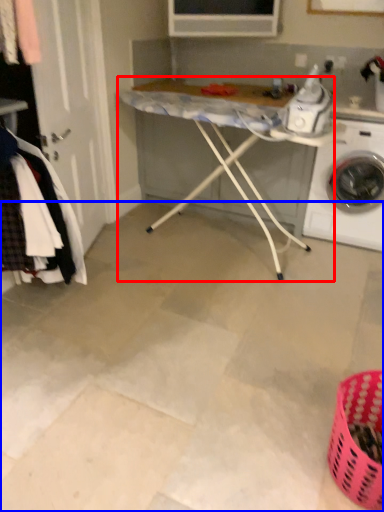
Question: Which object is closer to the camera taking this photo, table (highlighted by a red box) or concrete (highlighted by a blue box)?

Choices:
 (A) table
 (B) concrete

Answer: (B)